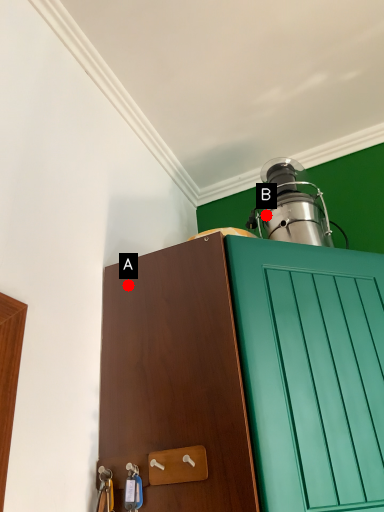
Question: Two points are circled on the image, labeled by A and B beside each circle. Among these points, which one is nearest to the camera?

Choices:
 (A) A is closer
 (B) B is closer

Answer: (A)